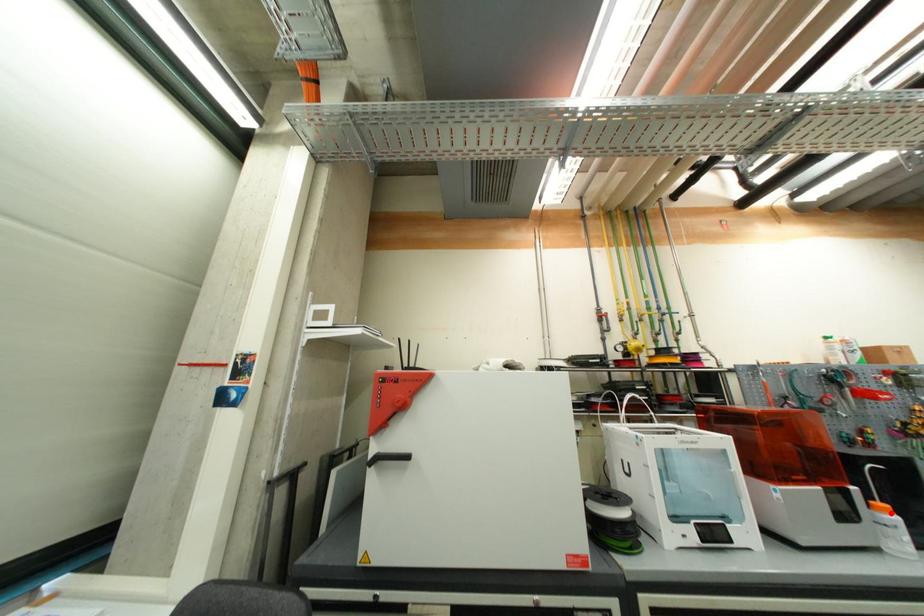
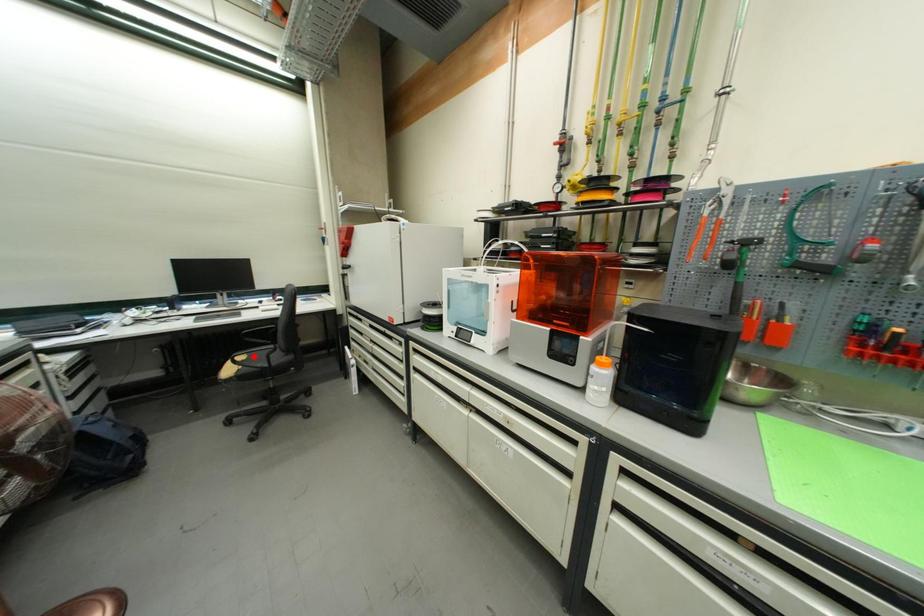
I am providing you with two images of the same scene from different viewpoints. A red point is marked on the first image and another point is marked on the second image. Do the highlighted points in image1 and image2 indicate the same real-world spot?

No